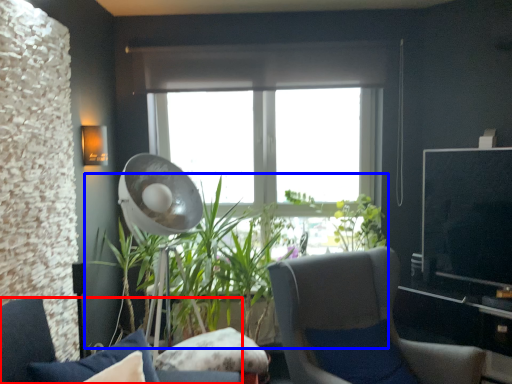
Question: Among these objects, which one is farthest to the camera, chair (highlighted by a red box) or houseplant (highlighted by a blue box)?

Choices:
 (A) chair
 (B) houseplant

Answer: (B)